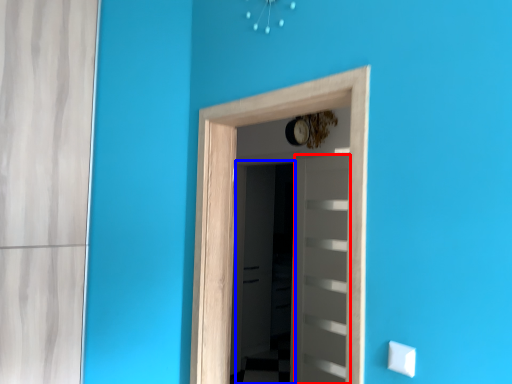
Question: Among these objects, which one is nearest to the camera, door (highlighted by a red box) or screen door (highlighted by a blue box)?

Choices:
 (A) door
 (B) screen door

Answer: (A)